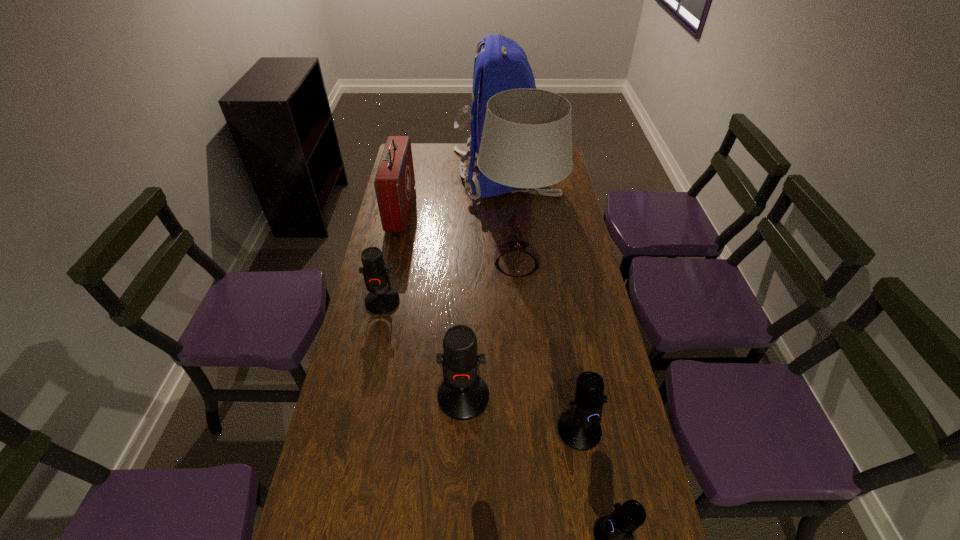
Where is `blank region between the farthest microphone and the bigger black microphone`? blank region between the farthest microphone and the bigger black microphone is located at coordinates (481, 366).

Where is `free space between the left red microphone and the farther black microphone`? The width and height of the screenshot is (960, 540). free space between the left red microphone and the farther black microphone is located at coordinates (481, 366).

At what (x,y) coordinates should I click in order to perform the action: click on free space between the smaller red microphone and the table lamp. Please return your answer as a coordinate pair (x, y). Image resolution: width=960 pixels, height=540 pixels. Looking at the image, I should click on (449, 282).

Where is `vacant space that's between the first-aid kit and the left red microphone`? The image size is (960, 540). vacant space that's between the first-aid kit and the left red microphone is located at coordinates (392, 255).

This screenshot has width=960, height=540. Identify the location of vacant area that lies between the farther black microphone and the table lamp. (548, 347).

In order to click on the fourth closest object relative to the red first-aid kit in this screenshot , I will do `click(463, 395)`.

Locate which object ranks second in proximity to the red first-aid kit. Please provide its 2D coordinates. Your answer should be formatted as a tuple, i.e. [(x, y)], where the tuple contains the x and y coordinates of a point satisfying the conditions above.

[(526, 143)]

Choose which microphone is the second nearest neighbor to the blue backpack. Please provide its 2D coordinates. Your answer should be formatted as a tuple, i.e. [(x, y)], where the tuple contains the x and y coordinates of a point satisfying the conditions above.

[(463, 395)]

The width and height of the screenshot is (960, 540). In order to click on microphone identified as the second closest to the shortest microphone in this screenshot , I will do `click(463, 395)`.

Point out which red microphone is positioned as the nearest to the nearer black microphone. Please provide its 2D coordinates. Your answer should be formatted as a tuple, i.e. [(x, y)], where the tuple contains the x and y coordinates of a point satisfying the conditions above.

[(463, 395)]